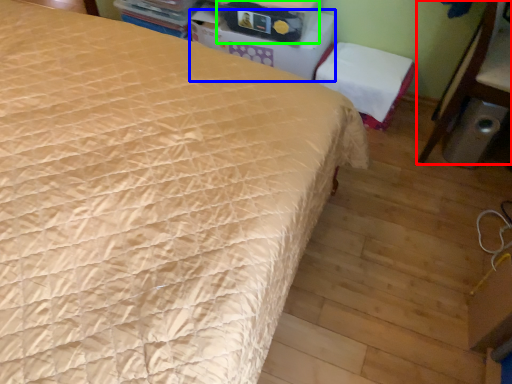
Question: Which is nearer to the furniture (highlighted by a red box)? table (highlighted by a blue box) or storage box (highlighted by a green box).

Choices:
 (A) table
 (B) storage box

Answer: (A)